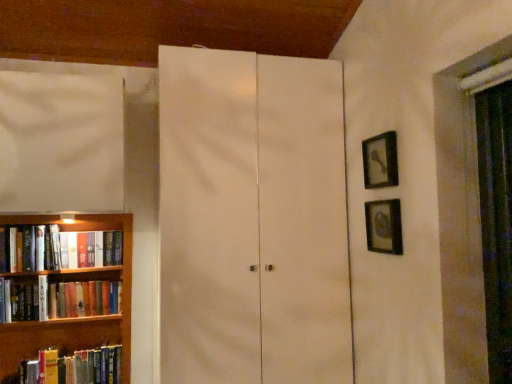
Question: Should I look upward or downward to see wooden bookshelf at left?

Choices:
 (A) up
 (B) down

Answer: (B)

Question: From the image's perspective, is metallic silver picture frame at right, which ranks as the first picture frame in bottom-to-top order, located above white matte cabinet at center?

Choices:
 (A) no
 (B) yes

Answer: (B)

Question: Is metallic silver picture frame at right, the 2th picture frame in the top-to-bottom sequence, bigger than white matte cabinet at center?

Choices:
 (A) yes
 (B) no

Answer: (B)

Question: Considering the relative sizes of metallic silver picture frame at right, the 2th picture frame in the top-to-bottom sequence, and white matte cabinet at center in the image provided, is metallic silver picture frame at right, the 2th picture frame in the top-to-bottom sequence, wider than white matte cabinet at center?

Choices:
 (A) no
 (B) yes

Answer: (A)

Question: From the image's perspective, does metallic silver picture frame at right, which ranks as the first picture frame in bottom-to-top order, appear lower than white matte cabinet at center?

Choices:
 (A) no
 (B) yes

Answer: (A)

Question: Is metallic silver picture frame at right, which ranks as the first picture frame in bottom-to-top order, oriented away from white matte cabinet at center?

Choices:
 (A) no
 (B) yes

Answer: (A)

Question: Does metallic silver picture frame at right, the 2th picture frame in the top-to-bottom sequence, have a lesser width compared to white matte cabinet at center?

Choices:
 (A) no
 (B) yes

Answer: (B)

Question: Is black matte picture frame at upper right, the 1th picture frame from the top, positioned beyond the bounds of hardcover book at left, the third book viewed from the top?

Choices:
 (A) no
 (B) yes

Answer: (B)

Question: Considering the relative sizes of black matte picture frame at upper right, the 1th picture frame from the top, and hardcover book at left, which is the 1th book from bottom to top, in the image provided, is black matte picture frame at upper right, the 1th picture frame from the top, taller than hardcover book at left, which is the 1th book from bottom to top,?

Choices:
 (A) yes
 (B) no

Answer: (A)

Question: Is black matte picture frame at upper right, the 1th picture frame from the top, next to hardcover book at left, which is the 1th book from bottom to top?

Choices:
 (A) yes
 (B) no

Answer: (B)

Question: Is hardcover book at left, the third book viewed from the top, at the back of black matte picture frame at upper right, which ranks as the second picture frame in bottom-to-top order?

Choices:
 (A) yes
 (B) no

Answer: (B)

Question: From the image's perspective, does black matte picture frame at upper right, the 1th picture frame from the top, appear lower than hardcover book at left, which is the 1th book from bottom to top?

Choices:
 (A) no
 (B) yes

Answer: (A)

Question: Is hardcover book at left, the third book viewed from the top, completely or partially inside black matte picture frame at upper right, the 1th picture frame from the top?

Choices:
 (A) no
 (B) yes

Answer: (A)

Question: Is wooden bookshelf at left with black matte picture frame at upper right, which ranks as the second picture frame in bottom-to-top order?

Choices:
 (A) yes
 (B) no

Answer: (B)